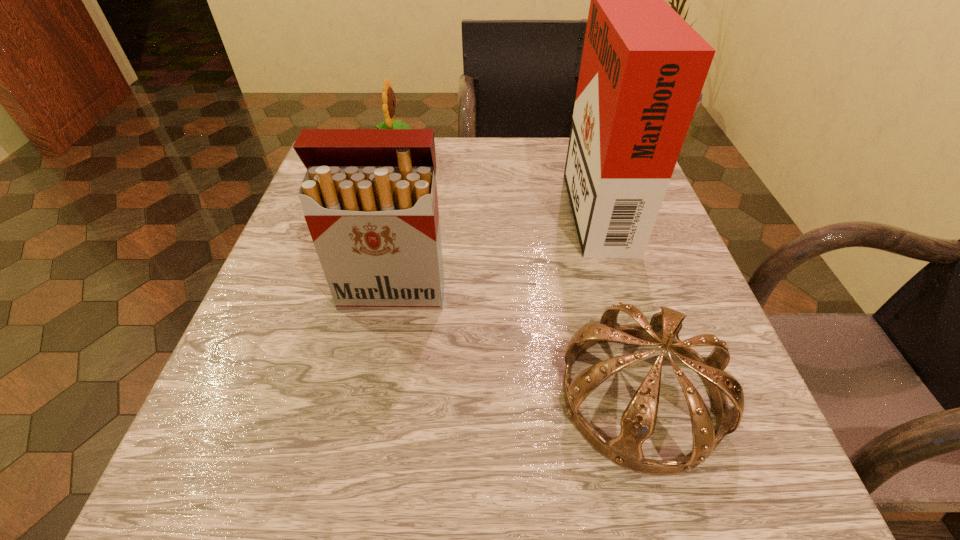
Where is `vacant region located 0.220m with the lid open on the nearer cigarette case`? The width and height of the screenshot is (960, 540). vacant region located 0.220m with the lid open on the nearer cigarette case is located at coordinates (365, 443).

Where is `vacant space located on the face of the third tallest object`? This screenshot has width=960, height=540. vacant space located on the face of the third tallest object is located at coordinates (539, 154).

This screenshot has width=960, height=540. In order to click on vacant space located on the back of the tiara in this screenshot , I will do `click(603, 265)`.

Where is `cigarette case located in the far edge section of the desktop`? This screenshot has height=540, width=960. cigarette case located in the far edge section of the desktop is located at coordinates (643, 67).

Identify the location of sunflower situated at the far edge. (388, 97).

Identify the location of object that is at the near edge. The height and width of the screenshot is (540, 960). (638, 421).

Where is `cigarette case present at the left edge`? Image resolution: width=960 pixels, height=540 pixels. cigarette case present at the left edge is located at coordinates (369, 196).

The image size is (960, 540). I want to click on sunflower present at the left edge, so click(388, 97).

Locate an element on the screen. cigarette case located at the right edge is located at coordinates (643, 67).

The width and height of the screenshot is (960, 540). I want to click on tiara that is at the right edge, so [x=638, y=421].